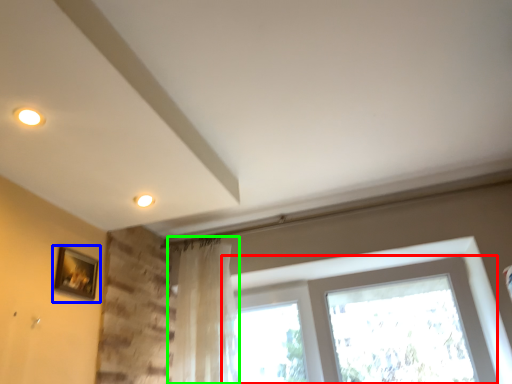
Question: Which object is the closest to the window (highlighted by a red box)? Choose among these: picture frame (highlighted by a blue box) or curtain (highlighted by a green box).

Choices:
 (A) picture frame
 (B) curtain

Answer: (B)